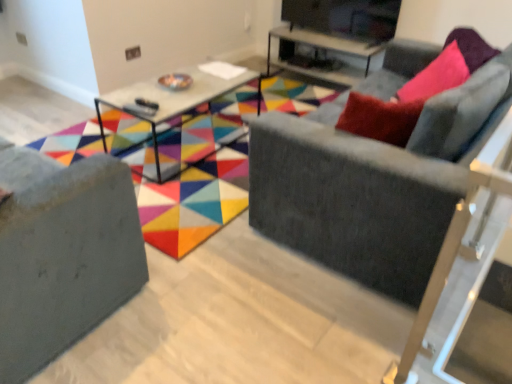
Question: Is velvet gray couch at right, marked as the first studio couch in a right-to-left arrangement, inside matte gray sofa at center?

Choices:
 (A) no
 (B) yes

Answer: (A)

Question: Does matte gray sofa at center have a smaller size compared to velvet gray couch at right, the 2th studio couch when ordered from left to right?

Choices:
 (A) no
 (B) yes

Answer: (B)

Question: Can we say matte gray sofa at center lies outside velvet gray couch at right, marked as the first studio couch in a right-to-left arrangement?

Choices:
 (A) no
 (B) yes

Answer: (B)

Question: From the image's perspective, is matte gray sofa at center above velvet gray couch at right, the 2th studio couch when ordered from left to right?

Choices:
 (A) no
 (B) yes

Answer: (B)

Question: Does matte gray sofa at center have a lesser width compared to velvet gray couch at right, marked as the first studio couch in a right-to-left arrangement?

Choices:
 (A) no
 (B) yes

Answer: (A)

Question: Is matte gray sofa at center to the right of velvet gray couch at right, marked as the first studio couch in a right-to-left arrangement, from the viewer's perspective?

Choices:
 (A) no
 (B) yes

Answer: (A)

Question: Considering the relative positions of velvet grey couch at lower left, positioned as the 2th studio couch in right-to-left order, and matte gray sofa at center in the image provided, is velvet grey couch at lower left, positioned as the 2th studio couch in right-to-left order, to the left of matte gray sofa at center from the viewer's perspective?

Choices:
 (A) yes
 (B) no

Answer: (A)

Question: Is the surface of velvet grey couch at lower left, positioned as the 2th studio couch in right-to-left order, in direct contact with matte gray sofa at center?

Choices:
 (A) no
 (B) yes

Answer: (A)

Question: Can you confirm if velvet grey couch at lower left, positioned as the 2th studio couch in right-to-left order, is positioned to the right of matte gray sofa at center?

Choices:
 (A) no
 (B) yes

Answer: (A)

Question: Does velvet grey couch at lower left, the first studio couch in the left-to-right sequence, lie in front of matte gray sofa at center?

Choices:
 (A) yes
 (B) no

Answer: (A)

Question: Can you confirm if velvet grey couch at lower left, positioned as the 2th studio couch in right-to-left order, is shorter than matte gray sofa at center?

Choices:
 (A) yes
 (B) no

Answer: (B)

Question: From the image's perspective, is velvet grey couch at lower left, the first studio couch in the left-to-right sequence, under matte gray sofa at center?

Choices:
 (A) no
 (B) yes

Answer: (B)

Question: Is matte black tv stand at upper center facing away from matte gray sofa at center?

Choices:
 (A) yes
 (B) no

Answer: (B)